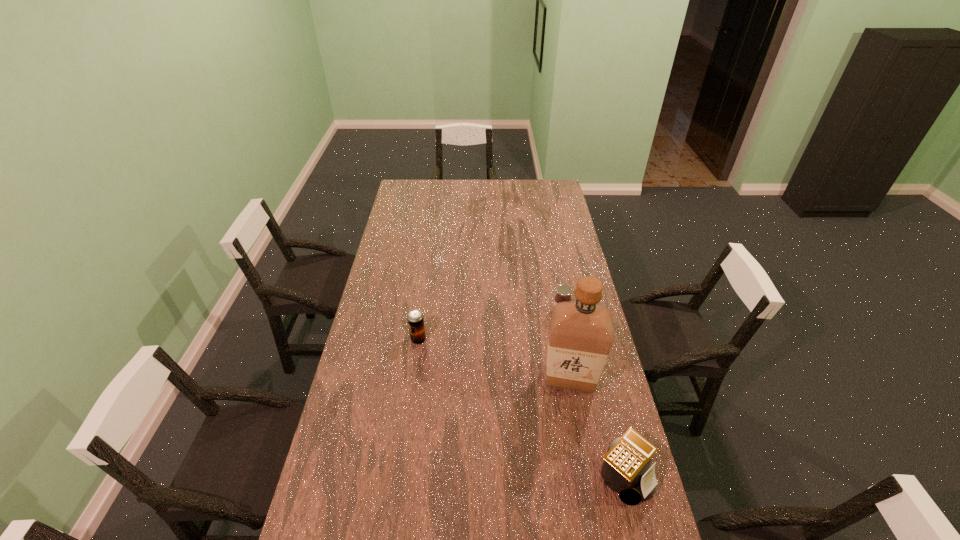
Where is `vacant region at the far right corner`? This screenshot has height=540, width=960. vacant region at the far right corner is located at coordinates (557, 191).

The width and height of the screenshot is (960, 540). I want to click on empty space between the liquor and the calculator, so click(596, 427).

The width and height of the screenshot is (960, 540). What are the coordinates of `free spot between the liquor and the nearest object` in the screenshot? It's located at (596, 427).

You are a GUI agent. You are given a task and a screenshot of the screen. Output one action in this format:
    pyautogui.click(x=<x>, y=<y>)
    Task: Click on the free space between the nearest object and the tallest object
    The height and width of the screenshot is (540, 960).
    Given the screenshot: What is the action you would take?
    pyautogui.click(x=596, y=427)

This screenshot has width=960, height=540. What are the coordinates of `free point between the farthest object and the nearest object` in the screenshot? It's located at (591, 394).

Where is `free space between the third nearest object and the farthest object`? free space between the third nearest object and the farthest object is located at coordinates (490, 326).

Identify the location of free space that is in between the farthest object and the nearest object. This screenshot has width=960, height=540. (591, 394).

The height and width of the screenshot is (540, 960). I want to click on unoccupied area between the second farthest object and the jam, so click(x=490, y=326).

At what (x,y) coordinates should I click in order to perform the action: click on vacant space in between the beer can and the jam. Please return your answer as a coordinate pair (x, y). Looking at the image, I should click on (490, 326).

At what (x,y) coordinates should I click in order to perform the action: click on free space between the liquor and the leftmost object. Please return your answer as a coordinate pair (x, y). This screenshot has height=540, width=960. Looking at the image, I should click on (494, 359).